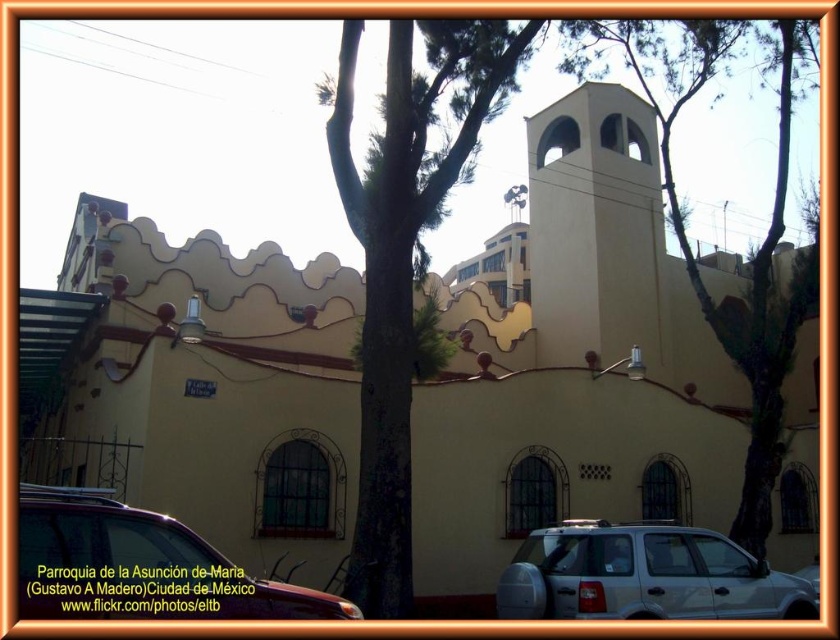
Question: Which of the following is the closest to the observer?

Choices:
 (A) metallic silver suv at lower left
 (B) green leafy tree at upper center
 (C) green leafy tree at center

Answer: (A)

Question: Among these objects, which one is farthest from the camera?

Choices:
 (A) metallic silver suv at lower left
 (B) green leafy tree at upper center

Answer: (B)

Question: Does green leafy tree at center have a lesser width compared to silver metallic suv at lower center?

Choices:
 (A) no
 (B) yes

Answer: (B)

Question: Which of these objects is positioned closest to the metallic silver suv at lower left?

Choices:
 (A) green leafy tree at center
 (B) green leafy tree at upper center

Answer: (A)

Question: Does green leafy tree at center appear on the left side of metallic silver suv at lower left?

Choices:
 (A) yes
 (B) no

Answer: (B)

Question: Can you confirm if green leafy tree at upper center is positioned above metallic silver suv at lower left?

Choices:
 (A) yes
 (B) no

Answer: (A)